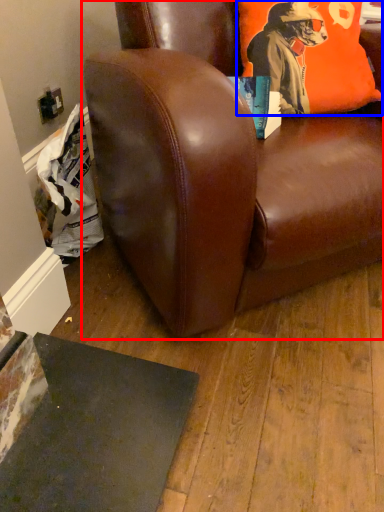
Question: Which object appears farthest to the camera in this image, chair (highlighted by a red box) or pillow (highlighted by a blue box)?

Choices:
 (A) chair
 (B) pillow

Answer: (B)